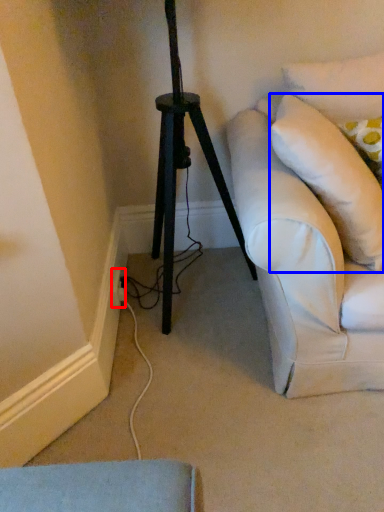
Question: Which point is further to the camera, electric outlet (highlighted by a red box) or pillow (highlighted by a blue box)?

Choices:
 (A) electric outlet
 (B) pillow

Answer: (A)